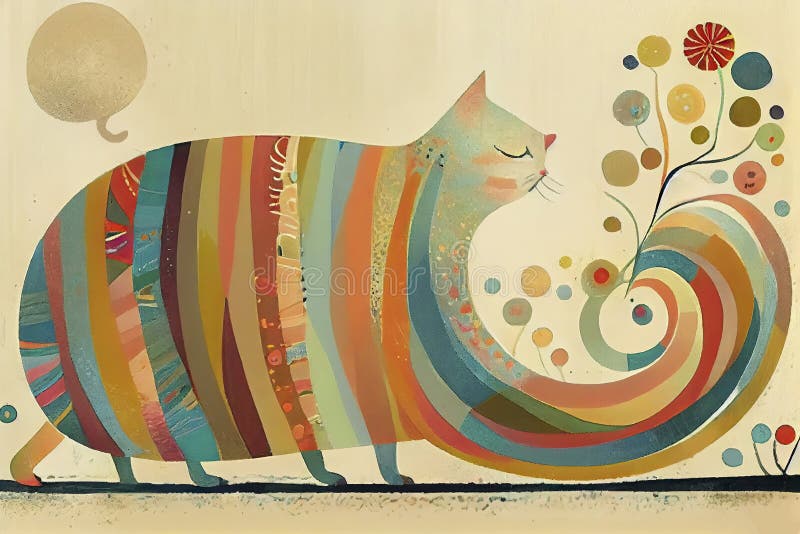
At what (x,y) coordinates should I click in order to perform the action: click on art painting. Please return your answer as a coordinate pair (x, y). The height and width of the screenshot is (534, 800). Looking at the image, I should click on (494, 128).